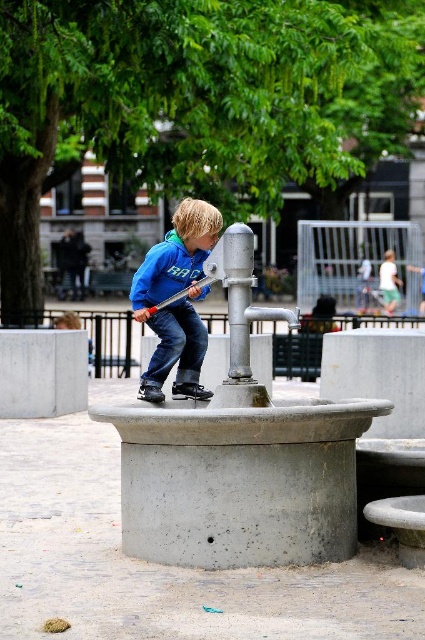
Looking at this image, you are a construction worker inspecting the fountain area. You notice the concreteroughfountain at center and the gray concrete at center. Which one is positioned lower in the scene?

The concreteroughfountain at center is located below gray concrete at center, so it is positioned lower in the scene.

You are standing at the origin point in the scene. The blue fleece jacket at center is located at coordinates point (176,300). If you want to move towards the blue fleece jacket at center, which direction should you move in?

The point (176,300) marks the location of the blue fleece jacket at center, so moving towards those coordinates would lead you directly to the blue fleece jacket at center.

You are a photographer trying to capture the boy in the scene. If you want to ensure both the blue fleece jacket at center and the gray concrete at center are in the frame, which object should you focus on to include both?

The blue fleece jacket at center is smaller than the gray concrete at center. To include both in the frame, focus on the gray concrete at center since it is larger and will help frame the scene effectively.